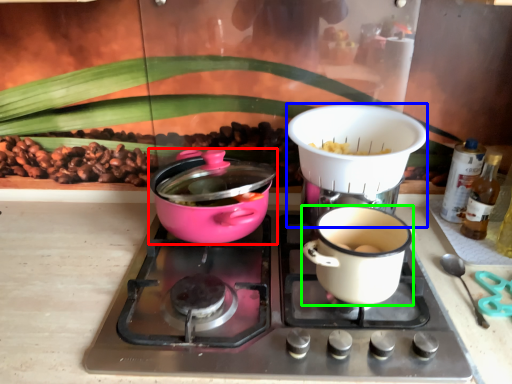
Question: Which is nearer to the kitchen appliance (highlighted by a red box)? appliance (highlighted by a blue box) or coffee cup (highlighted by a green box).

Choices:
 (A) appliance
 (B) coffee cup

Answer: (A)